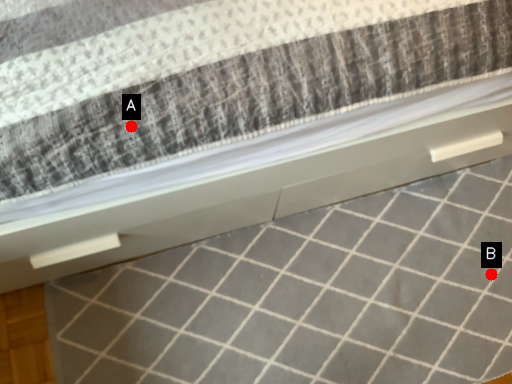
Question: Two points are circled on the image, labeled by A and B beside each circle. Which point is farther to the camera?

Choices:
 (A) A is further
 (B) B is further

Answer: (B)